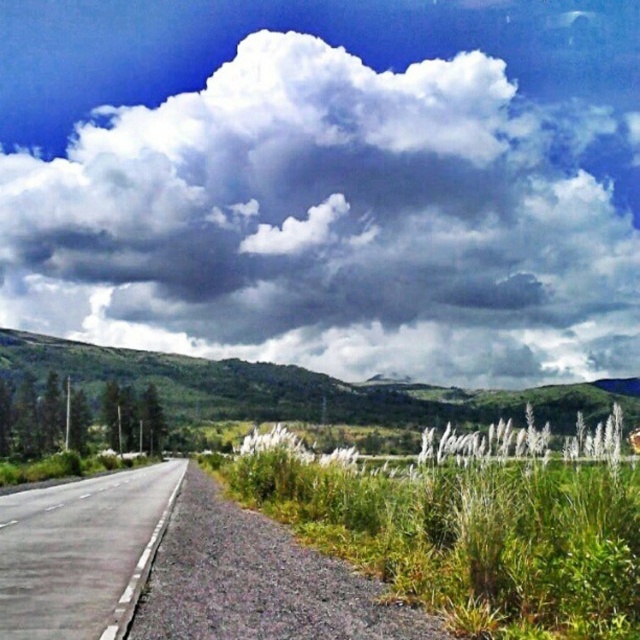
You are a photographer planning to capture the white fluffy cloud at upper center and the asphalt road at left in the same frame. Which object will appear larger in the photo?

The white fluffy cloud at upper center will appear larger in the photo because it is much taller than the asphalt road at left.

Consider the image. You are standing at the edge of the asphalt road at left and looking towards the white fluffy cloud at upper center. Which object is closer to you?

The white fluffy cloud at upper center is closer to you because the asphalt road at left is behind it.